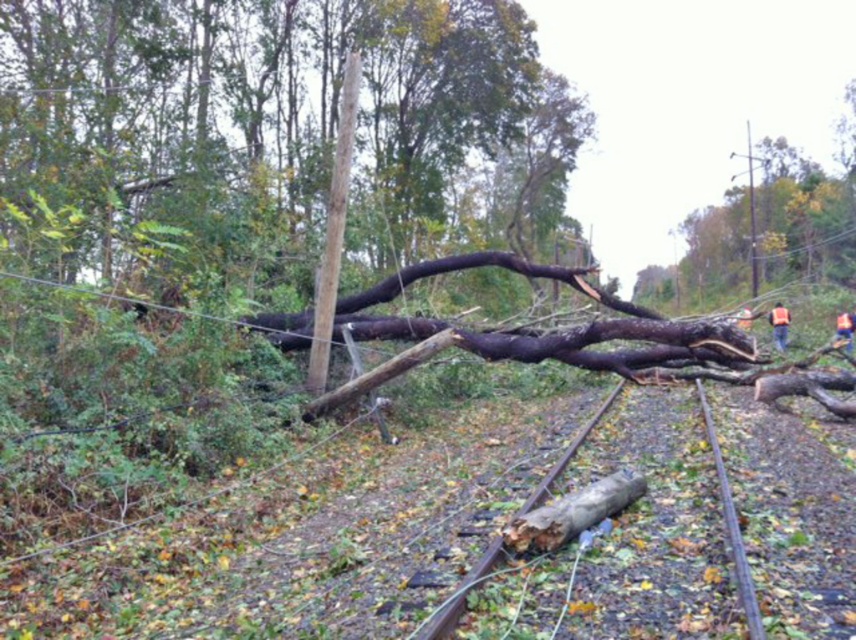
You are a railway inspector checking the tracks after a storm. You notice the brown wood log at center and the orange reflective vest at right. Which object is closer to the tracks?

The brown wood log at center is closer to the tracks because it is in front of the orange reflective vest at right.

You are a railway inspector checking the tracks after a storm. You notice the brown wood log at center and the orange reflective vest at right. Based on their positions, which object is closer to the left side of the tracks?

The brown wood log at center is to the left of the orange reflective vest at right, so the brown wood log at center is closer to the left side of the tracks.

You are a railway inspector checking the tracks after a storm. You notice a point marked at coordinates (730, 524). What object is located at that point?

The point at coordinates (730, 524) marks the brown wood log at center.